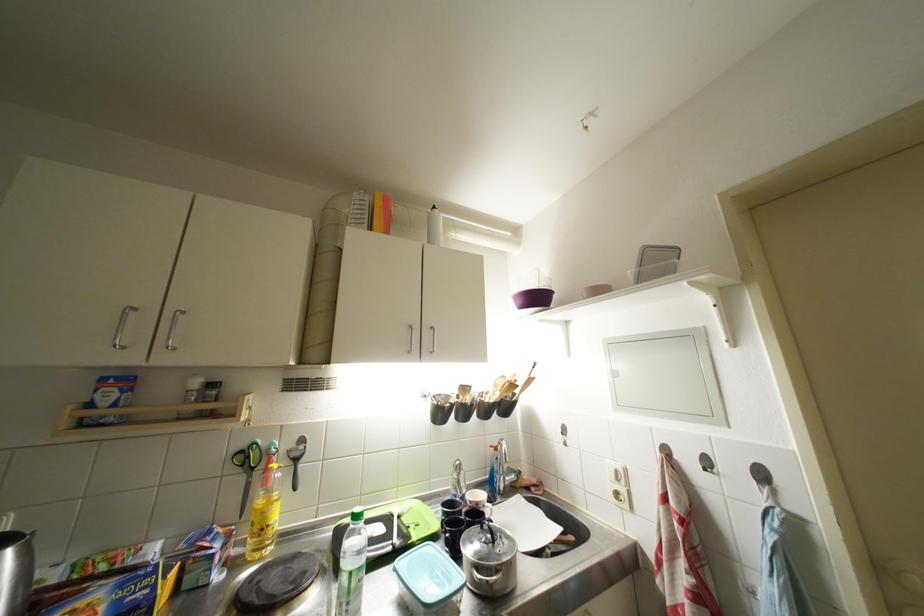
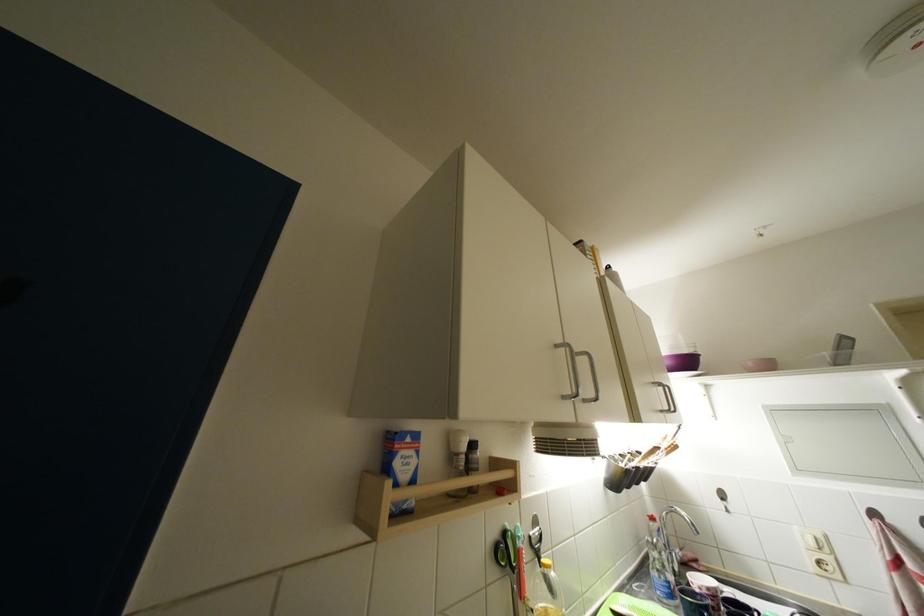
In the second image, find the point that corresponds to point 104,400 in the first image.

(404, 467)